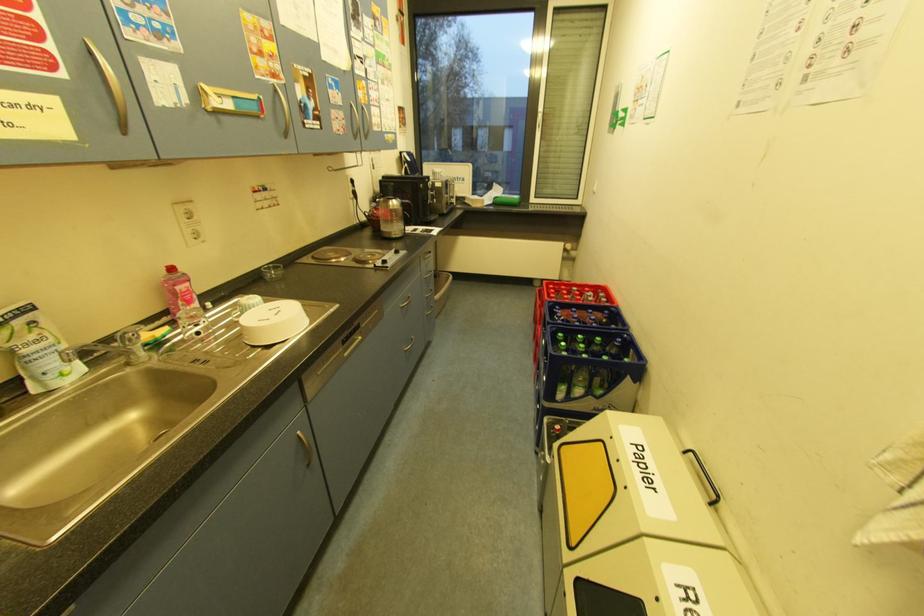
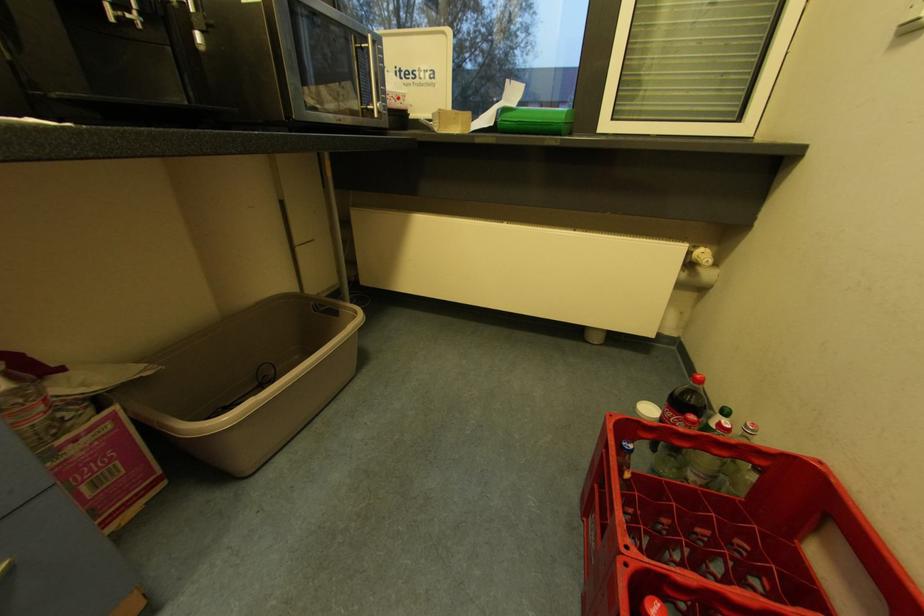
Question: The images are taken continuously from a first-person perspective. In which direction are you moving?

Choices:
 (A) Left
 (B) Right
 (C) Forward
 (D) Backward

Answer: (C)